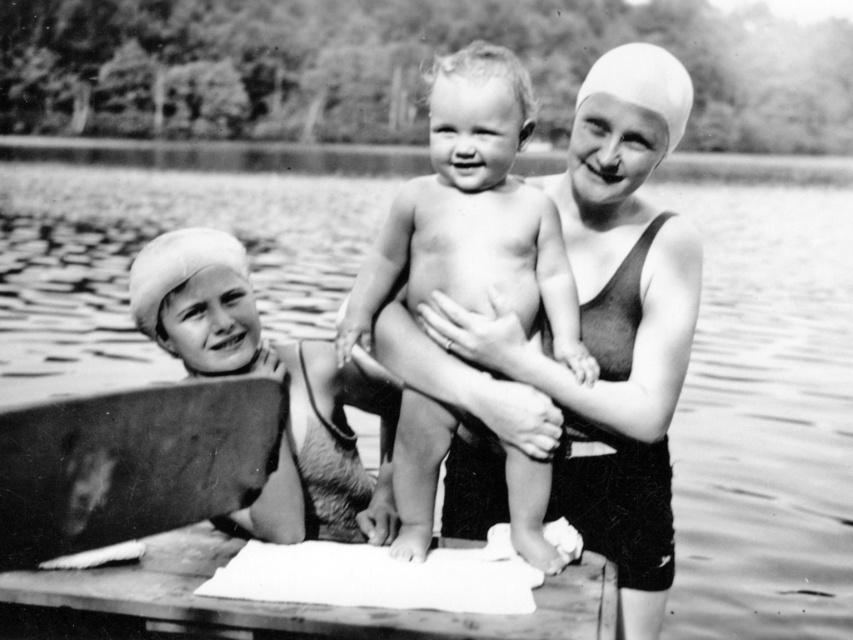
Who is higher up, smooth skin baby at center or smooth white swim cap at left?

smooth skin baby at center

Can you confirm if smooth skin baby at center is thinner than smooth white swim cap at left?

Indeed, smooth skin baby at center has a lesser width compared to smooth white swim cap at left.

Where is `smooth skin baby at center`? The height and width of the screenshot is (640, 853). smooth skin baby at center is located at coordinates (474, 212).